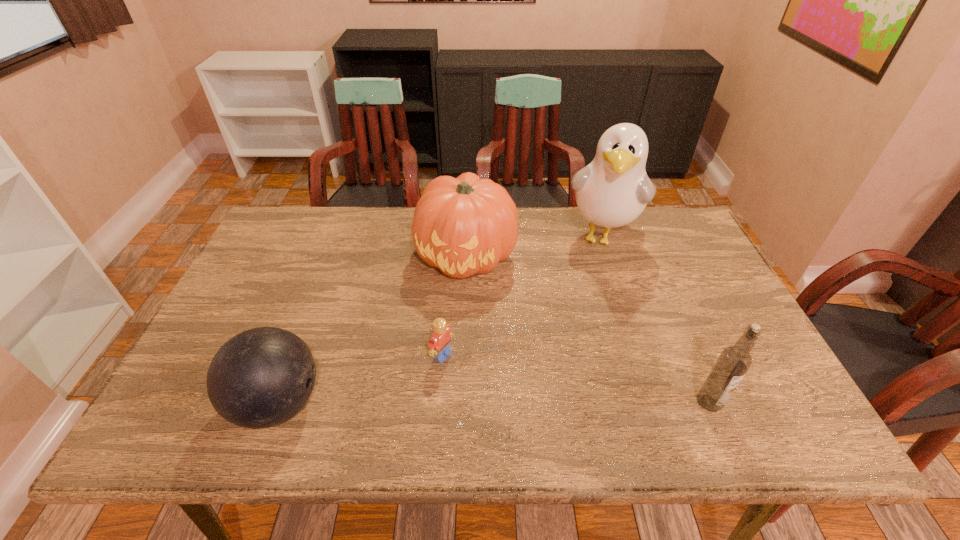
Identify the location of vacant area situated on the carved face of the pumpkin. (455, 322).

Where is `free location located on the carved face of the pumpkin`? The width and height of the screenshot is (960, 540). free location located on the carved face of the pumpkin is located at coordinates (453, 332).

The image size is (960, 540). Identify the location of free spot located on the carved face of the pumpkin. (441, 397).

I want to click on free space located on the beak of the gull, so click(x=578, y=334).

The height and width of the screenshot is (540, 960). In order to click on free space located 0.190m on the beak of the gull in this screenshot , I will do `click(585, 309)`.

I want to click on free location located 0.140m on the beak of the gull, so click(588, 297).

This screenshot has width=960, height=540. I want to click on pumpkin that is at the far edge, so click(466, 225).

The width and height of the screenshot is (960, 540). Identify the location of gull that is positioned at the far edge. (613, 190).

Identify the location of bowling ball located in the near edge section of the desktop. (261, 377).

Where is `vodka present at the near edge`? The image size is (960, 540). vodka present at the near edge is located at coordinates (734, 361).